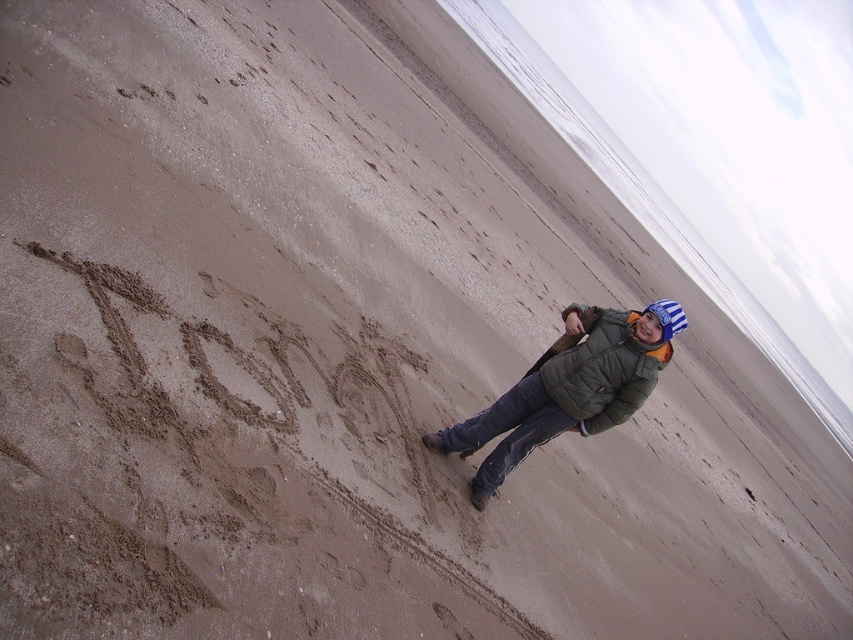
Question: From the image, what is the correct spatial relationship of green fuzzy jacket at center in relation to green matte jacket at lower right?

Choices:
 (A) above
 (B) below

Answer: (B)

Question: Does green fuzzy jacket at center appear over green matte jacket at lower right?

Choices:
 (A) yes
 (B) no

Answer: (B)

Question: Which object appears farthest from the camera in this image?

Choices:
 (A) green fuzzy jacket at center
 (B) green matte jacket at lower right

Answer: (B)

Question: Does green fuzzy jacket at center have a smaller size compared to green matte jacket at lower right?

Choices:
 (A) no
 (B) yes

Answer: (A)